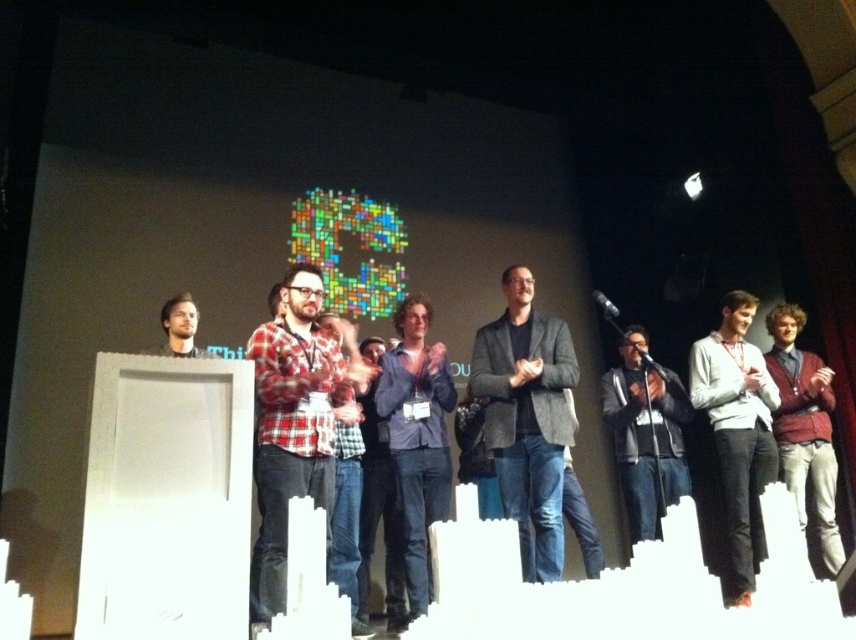
Question: Which is nearer to the matte black shirt at left?

Choices:
 (A) white matte shirt at center
 (B) gray woolen blazer at center
 (C) blue denim jeans at center
 (D) red plaid shirt at center

Answer: (D)

Question: Can you confirm if matte black podium at center is positioned to the left of silver metallic microphone at center?

Choices:
 (A) yes
 (B) no

Answer: (B)

Question: Can you confirm if gray woolen blazer at center is smaller than matte black podium at center?

Choices:
 (A) yes
 (B) no

Answer: (B)

Question: Does matte black podium at center come in front of silver metallic microphone at center?

Choices:
 (A) no
 (B) yes

Answer: (B)

Question: Estimate the real-world distances between objects in this image. Which object is farther from the matte black shirt at left?

Choices:
 (A) dark gray sweater at center
 (B) gray woolen blazer at center

Answer: (A)

Question: Among these points, which one is nearest to the camera?

Choices:
 (A) (792, 424)
 (B) (532, 296)
 (C) (189, 314)
 (D) (609, 307)

Answer: (D)